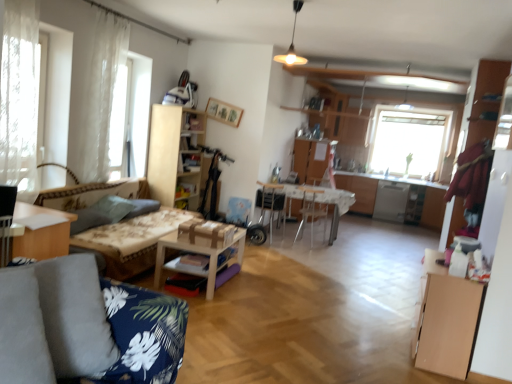
Question: Does satin silver dishwasher at right have a smaller size compared to light wood cabinet at center, arranged as the second cabinetry when viewed from the front?

Choices:
 (A) yes
 (B) no

Answer: (A)

Question: Could you tell me if satin silver dishwasher at right is turned towards light wood cabinet at center, arranged as the second cabinetry when viewed from the front?

Choices:
 (A) yes
 (B) no

Answer: (B)

Question: Is satin silver dishwasher at right turned away from light wood cabinet at center, which ranks as the 2th cabinetry in right-to-left order?

Choices:
 (A) no
 (B) yes

Answer: (A)

Question: Considering the relative positions of satin silver dishwasher at right and light wood cabinet at center, arranged as the second cabinetry when viewed from the front, in the image provided, is satin silver dishwasher at right to the right of light wood cabinet at center, arranged as the second cabinetry when viewed from the front, from the viewer's perspective?

Choices:
 (A) no
 (B) yes

Answer: (B)

Question: Does satin silver dishwasher at right touch light wood cabinet at center, the second cabinetry from the bottom?

Choices:
 (A) no
 (B) yes

Answer: (A)

Question: In terms of width, does light brown wood cabinet at lower right, the first cabinetry positioned from the bottom, look wider or thinner when compared to wooden chair at center, the second armchair when ordered from left to right?

Choices:
 (A) thin
 (B) wide

Answer: (A)

Question: From a real-world perspective, relative to wooden chair at center, arranged as the second armchair when viewed from the front, is light brown wood cabinet at lower right, which is counted as the 2th cabinetry, starting from the left, vertically above or below?

Choices:
 (A) above
 (B) below

Answer: (B)

Question: Which is correct: light brown wood cabinet at lower right, the first cabinetry from the right, is inside wooden chair at center, positioned as the first armchair in right-to-left order, or outside of it?

Choices:
 (A) inside
 (B) outside

Answer: (B)

Question: Is light brown wood cabinet at lower right, which is counted as the 2th cabinetry, starting from the left, to the left or to the right of wooden chair at center, positioned as the first armchair in right-to-left order, in the image?

Choices:
 (A) left
 (B) right

Answer: (B)

Question: Is gray fabric pillow at left, the second pillow when ordered from front to back, wider or thinner than light brown wood cabinet at lower right, the first cabinetry from the front?

Choices:
 (A) thin
 (B) wide

Answer: (A)

Question: Is gray fabric pillow at left, arranged as the 1th pillow when viewed from the back, taller or shorter than light brown wood cabinet at lower right, the first cabinetry from the front?

Choices:
 (A) tall
 (B) short

Answer: (B)

Question: From the image's perspective, is gray fabric pillow at left, the second pillow when ordered from front to back, located above or below light brown wood cabinet at lower right, which is counted as the 2th cabinetry, starting from the left?

Choices:
 (A) below
 (B) above

Answer: (B)

Question: From a real-world perspective, relative to light brown wood cabinet at lower right, the first cabinetry positioned from the bottom, is gray fabric pillow at left, arranged as the 1th pillow when viewed from the back, vertically above or below?

Choices:
 (A) below
 (B) above

Answer: (B)

Question: Is floral fabric couch at left taller or shorter than satin silver dishwasher at right?

Choices:
 (A) short
 (B) tall

Answer: (A)

Question: Considering the positions of point (103, 183) and point (389, 201), is point (103, 183) closer or farther from the camera than point (389, 201)?

Choices:
 (A) closer
 (B) farther

Answer: (A)